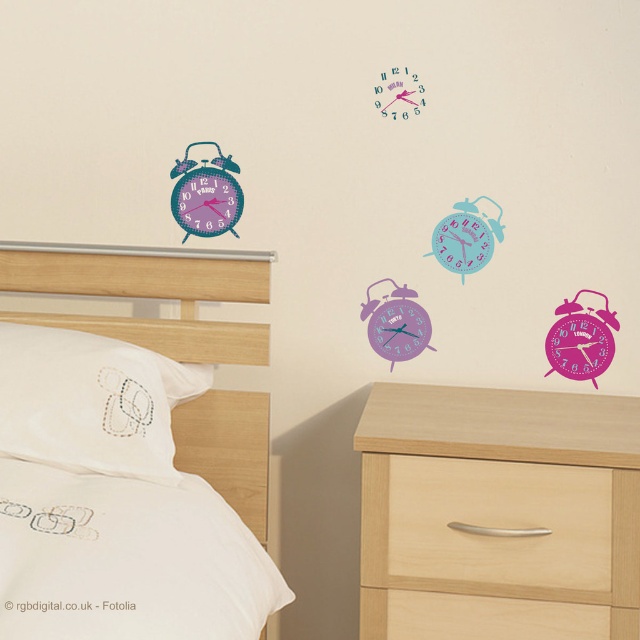
Question: Which of the following is the closest to the observer?

Choices:
 (A) purple glossy alarm clock at center
 (B) light wood/dark finish drawer at lower center
 (C) pink glossy alarm clock at upper right

Answer: (B)

Question: Does white fabric bed at upper left appear under light wood/texture drawer at lower center?

Choices:
 (A) yes
 (B) no

Answer: (B)

Question: Observing the image, what is the correct spatial positioning of matte purple alarm clock at upper left in reference to purple glossy alarm clock at center?

Choices:
 (A) below
 (B) above

Answer: (B)

Question: Which object is farther from the camera taking this photo?

Choices:
 (A) purple glossy alarm clock at center
 (B) pink glossy alarm clock at upper right

Answer: (A)

Question: Can you confirm if matte purple alarm clock at upper left is wider than pink glossy alarm clock at upper right?

Choices:
 (A) no
 (B) yes

Answer: (B)

Question: Which of the following is the closest to the observer?

Choices:
 (A) white fabric bed at upper left
 (B) light wood/dark finish dresser at lower right
 (C) teal glossy alarm clock at center
 (D) light wood/texture drawer at lower center

Answer: (B)